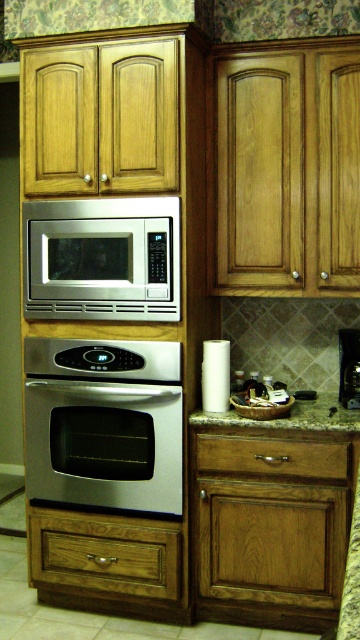
Does point (101, 492) come behind point (133, 227)?

Yes, point (101, 492) is farther from viewer.

Image resolution: width=360 pixels, height=640 pixels. What do you see at coordinates (104, 422) in the screenshot?
I see `stainless steel oven at center` at bounding box center [104, 422].

Image resolution: width=360 pixels, height=640 pixels. I want to click on stainless steel oven at center, so click(x=104, y=422).

Between wooden drawer at lower left and wooden drawer at lower center, which one is positioned higher?

wooden drawer at lower center is above.

Is wooden drawer at lower left positioned in front of wooden drawer at lower center?

No, it is behind wooden drawer at lower center.

Identify the location of wooden drawer at lower left. (105, 554).

In order to click on wooden drawer at lower left in this screenshot , I will do `click(105, 554)`.

Between wooden drawer at lower center and granite countertop at lower center, which one has less height?

With less height is granite countertop at lower center.

Is point (219, 435) positioned behind point (251, 420)?

Yes, point (219, 435) is farther from viewer.

Find the location of a particular element. The height and width of the screenshot is (640, 360). wooden drawer at lower center is located at coordinates (272, 456).